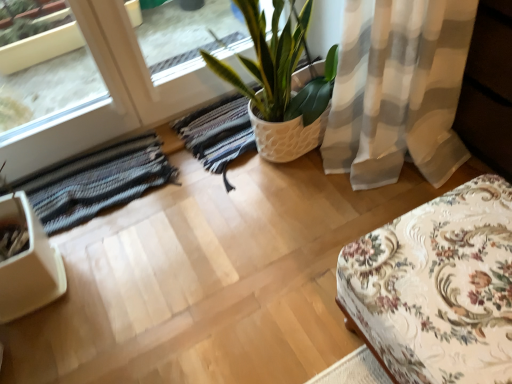
Question: Considering the relative sizes of striped woolen rug at lower left and white textured pot at center in the image provided, is striped woolen rug at lower left smaller than white textured pot at center?

Choices:
 (A) yes
 (B) no

Answer: (A)

Question: From a real-world perspective, is striped woolen rug at lower left on white textured pot at center?

Choices:
 (A) yes
 (B) no

Answer: (B)

Question: Is striped woolen rug at lower left outside white textured pot at center?

Choices:
 (A) yes
 (B) no

Answer: (A)

Question: Considering the relative sizes of striped woolen rug at lower left and white textured pot at center in the image provided, is striped woolen rug at lower left bigger than white textured pot at center?

Choices:
 (A) no
 (B) yes

Answer: (A)

Question: Does striped woolen rug at lower left have a lesser width compared to white textured pot at center?

Choices:
 (A) yes
 (B) no

Answer: (A)

Question: Is striped woolen rug at lower left at the left side of white textured pot at center?

Choices:
 (A) yes
 (B) no

Answer: (A)

Question: Is floral fabric ottoman at lower right in front of striped woolen rug at lower left?

Choices:
 (A) no
 (B) yes

Answer: (B)

Question: Are floral fabric ottoman at lower right and striped woolen rug at lower left far apart?

Choices:
 (A) no
 (B) yes

Answer: (A)

Question: Considering the relative sizes of floral fabric ottoman at lower right and striped woolen rug at lower left in the image provided, is floral fabric ottoman at lower right taller than striped woolen rug at lower left?

Choices:
 (A) no
 (B) yes

Answer: (B)

Question: Could you tell me if floral fabric ottoman at lower right is turned towards striped woolen rug at lower left?

Choices:
 (A) no
 (B) yes

Answer: (A)

Question: From the image's perspective, is floral fabric ottoman at lower right beneath striped woolen rug at lower left?

Choices:
 (A) yes
 (B) no

Answer: (A)

Question: Is floral fabric ottoman at lower right located outside striped woolen rug at lower left?

Choices:
 (A) no
 (B) yes

Answer: (B)

Question: Is white textured pot at center located outside floral fabric ottoman at lower right?

Choices:
 (A) no
 (B) yes

Answer: (B)